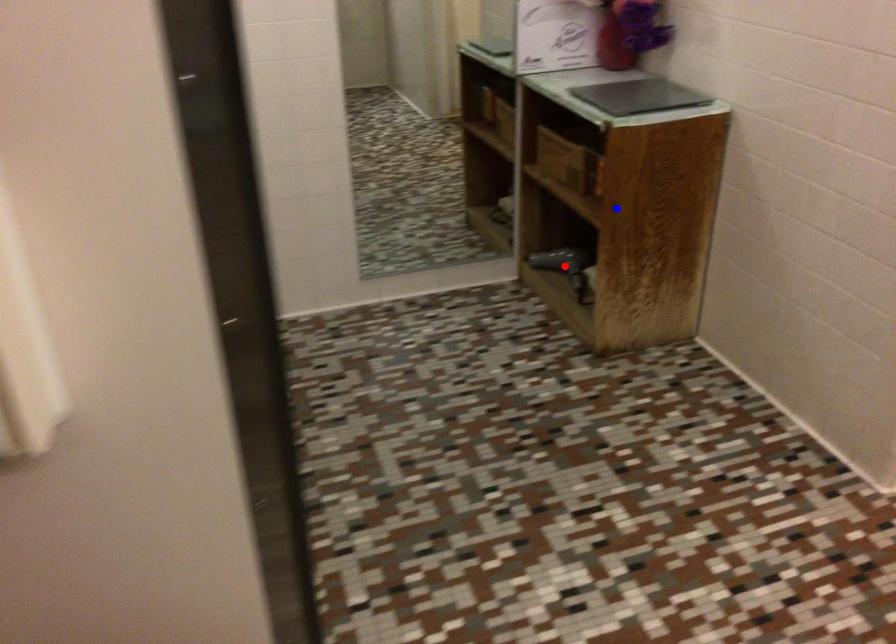
Question: Two points are marked on the image. Which point is closer to the camera?

Choices:
 (A) Blue point is closer.
 (B) Red point is closer.

Answer: (A)